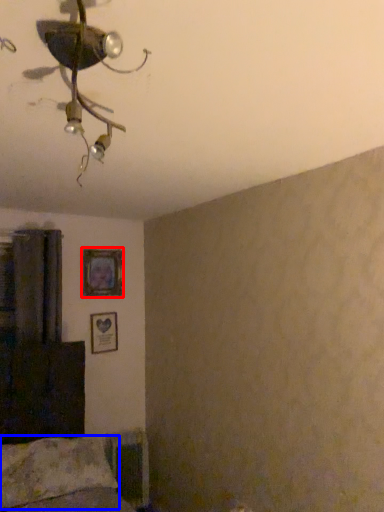
Question: Which of the following is the farthest to the observer, picture frame (highlighted by a red box) or pillow (highlighted by a blue box)?

Choices:
 (A) picture frame
 (B) pillow

Answer: (A)